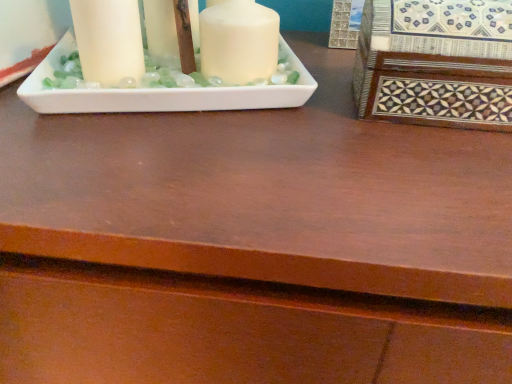
Question: Should I look upward or downward to see inlaid wood box at right?

Choices:
 (A) up
 (B) down

Answer: (A)